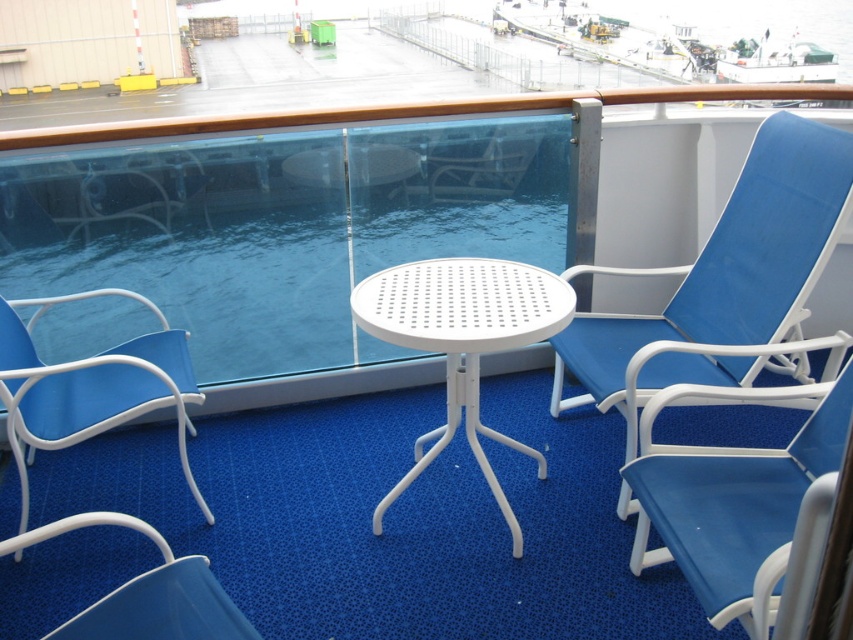
You are standing on the balcony and want to reach a point that is exactly 2 meters away from you. Is the point at coordinates point (503, 282) within that distance?

The point (503, 282) is 2.19 meters from viewer, so it is slightly beyond the 2 meter distance.

You are a passenger on a cruise ship and want to sit on one of the two beach chairs available. The blue fabric beach chair at lower right and the matte blue beach chair at lower left are both options. Which chair has a larger size?

The blue fabric beach chair at lower right is bigger than the matte blue beach chair at lower left according to the description.